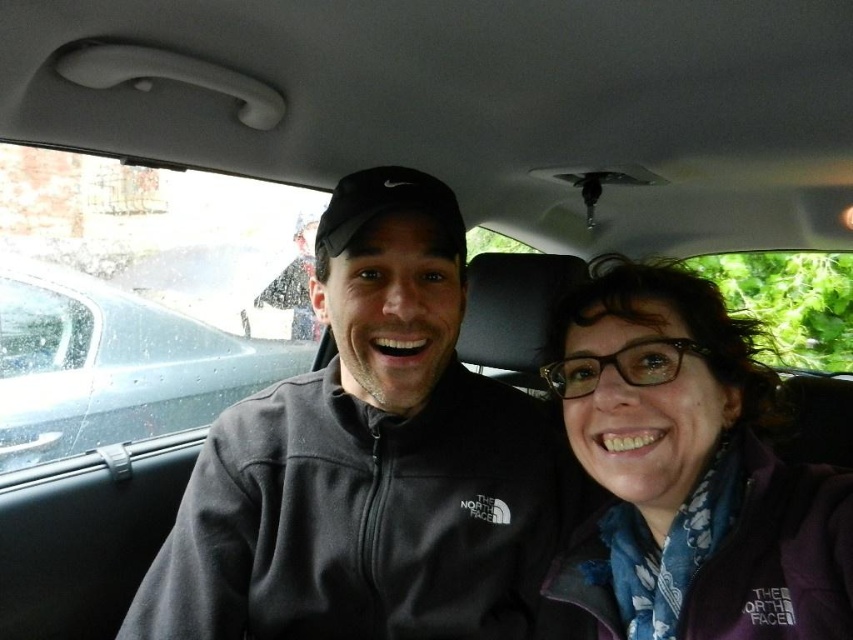
Question: Is dark gray fleece jacket at center wider than metallic gray car at left?

Choices:
 (A) yes
 (B) no

Answer: (B)

Question: Which object is positioned closest to the metallic gray car at left?

Choices:
 (A) dark gray fleece jacket at center
 (B) purple fleece jacket at center

Answer: (A)

Question: Is purple fleece jacket at center below metallic gray car at left?

Choices:
 (A) yes
 (B) no

Answer: (B)

Question: Which object is closer to the camera taking this photo?

Choices:
 (A) dark gray fleece jacket at center
 (B) metallic gray car at left

Answer: (A)

Question: Can you confirm if dark gray fleece jacket at center is positioned to the left of purple fleece jacket at center?

Choices:
 (A) yes
 (B) no

Answer: (A)

Question: Which object is farther from the camera taking this photo?

Choices:
 (A) dark gray fleece jacket at center
 (B) metallic gray car at left

Answer: (B)